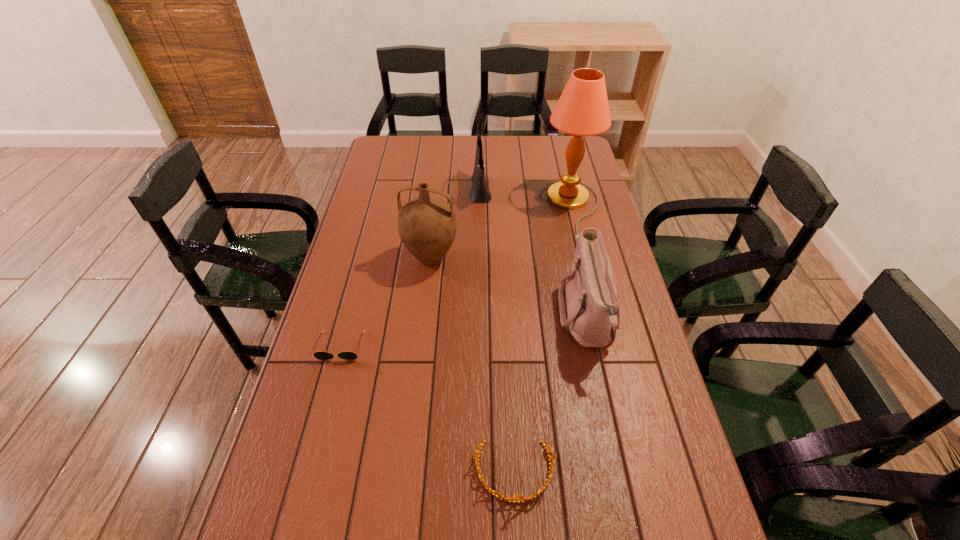
At what (x,y) coordinates should I click in order to perform the action: click on vacant area located 0.290m on the back of the tallest object. Please return your answer as a coordinate pair (x, y). Image resolution: width=960 pixels, height=540 pixels. Looking at the image, I should click on [x=556, y=145].

Where is `vacant space located on the right of the fifth object from right to left`? vacant space located on the right of the fifth object from right to left is located at coordinates (573, 259).

You are a GUI agent. You are given a task and a screenshot of the screen. Output one action in this format:
    pyautogui.click(x=<x>, y=<y>)
    Task: Click on the vacant space located 0.190m on the left of the farther shoulder bag
    Image resolution: width=960 pixels, height=540 pixels.
    Given the screenshot: What is the action you would take?
    pyautogui.click(x=421, y=190)

This screenshot has height=540, width=960. What are the coordinates of `vacant space located on the front pocket of the right shoulder bag` in the screenshot? It's located at (458, 319).

What are the coordinates of `vacant space located 0.140m on the front pocket of the right shoulder bag` in the screenshot? It's located at (510, 319).

Where is `vacant space situated 0.200m on the front pocket of the right shoulder bag`? The image size is (960, 540). vacant space situated 0.200m on the front pocket of the right shoulder bag is located at coordinates (490, 319).

Where is `free space located on the front-facing side of the sunglasses`? The image size is (960, 540). free space located on the front-facing side of the sunglasses is located at coordinates (320, 426).

The width and height of the screenshot is (960, 540). Find the location of `object present at the left edge`. object present at the left edge is located at coordinates (321, 355).

Identify the location of lamp present at the right edge. (582, 110).

What are the coordinates of `shoulder bag at the right edge` in the screenshot? It's located at (589, 305).